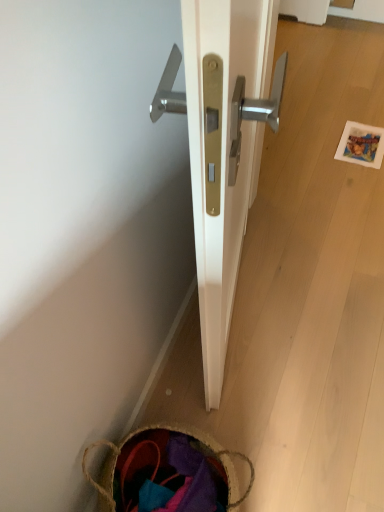
This screenshot has width=384, height=512. Describe the element at coordinates (223, 146) in the screenshot. I see `polished brass door handle at center` at that location.

Where is `polished brass door handle at center`? polished brass door handle at center is located at coordinates click(x=223, y=146).

This screenshot has height=512, width=384. What do you see at coordinates (169, 473) in the screenshot?
I see `brown woven basket at lower left` at bounding box center [169, 473].

Where is `brown woven basket at lower left`? brown woven basket at lower left is located at coordinates (169, 473).

Locate an element on the screen. polished brass door handle at center is located at coordinates (223, 146).

Which object is positioned more to the left, polished brass door handle at center or brown woven basket at lower left?

Positioned to the left is brown woven basket at lower left.

Which is behind, polished brass door handle at center or brown woven basket at lower left?

brown woven basket at lower left is more distant.

Does point (204, 77) lie behind point (197, 450)?

No, (204, 77) is closer to viewer.

From the image's perspective, which one is positioned lower, polished brass door handle at center or brown woven basket at lower left?

From the image's view, brown woven basket at lower left is below.

From the picture: From a real-world perspective, is polished brass door handle at center positioned under brown woven basket at lower left based on gravity?

No.

Which object is wider, polished brass door handle at center or brown woven basket at lower left?

brown woven basket at lower left is wider.

In terms of height, does polished brass door handle at center look taller or shorter compared to brown woven basket at lower left?

Considering their sizes, polished brass door handle at center has more height than brown woven basket at lower left.

Is polished brass door handle at center bigger than brown woven basket at lower left?

Indeed, polished brass door handle at center has a larger size compared to brown woven basket at lower left.

Can brown woven basket at lower left be found inside polished brass door handle at center?

No, polished brass door handle at center does not contain brown woven basket at lower left.

Are polished brass door handle at center and brown woven basket at lower left making contact?

No, polished brass door handle at center is not beside brown woven basket at lower left.

Could you tell me if polished brass door handle at center is turned towards brown woven basket at lower left?

No.

At what (x,y) coordinates should I click in order to perform the action: click on basket behind the polished brass door handle at center. Please return your answer as a coordinate pair (x, y). Looking at the image, I should click on (169, 473).

Considering the positions of objects brown woven basket at lower left and polished brass door handle at center in the image provided, who is more to the right, brown woven basket at lower left or polished brass door handle at center?

Positioned to the right is polished brass door handle at center.

Is brown woven basket at lower left closer to camera compared to polished brass door handle at center?

No, brown woven basket at lower left is further to the viewer.

Does point (116, 455) come closer to viewer compared to point (239, 71)?

No, (116, 455) is behind (239, 71).

From the image's perspective, is brown woven basket at lower left below polished brass door handle at center?

Yes, from the image's perspective, brown woven basket at lower left is below polished brass door handle at center.

From a real-world perspective, which object rests below the other?

brown woven basket at lower left is physically lower.

Can you confirm if brown woven basket at lower left is thinner than polished brass door handle at center?

No.

In the scene shown: Is brown woven basket at lower left taller or shorter than polished brass door handle at center?

In the image, brown woven basket at lower left appears to be shorter than polished brass door handle at center.

From the picture: Does brown woven basket at lower left have a smaller size compared to polished brass door handle at center?

Correct, brown woven basket at lower left occupies less space than polished brass door handle at center.

Would you say brown woven basket at lower left is outside polished brass door handle at center?

Yes, brown woven basket at lower left is not within polished brass door handle at center.

Is there a large distance between brown woven basket at lower left and polished brass door handle at center?

No, brown woven basket at lower left is in close proximity to polished brass door handle at center.

Is brown woven basket at lower left turned away from polished brass door handle at center?

That's not correct — brown woven basket at lower left is not looking away from polished brass door handle at center.

Locate an element on the screen. door in front of the brown woven basket at lower left is located at coordinates coord(223,146).

Where is `door above the brown woven basket at lower left (from the image's perspective)`? This screenshot has height=512, width=384. door above the brown woven basket at lower left (from the image's perspective) is located at coordinates (223, 146).

Locate an element on the screen. Image resolution: width=384 pixels, height=512 pixels. door on the right of brown woven basket at lower left is located at coordinates (223, 146).